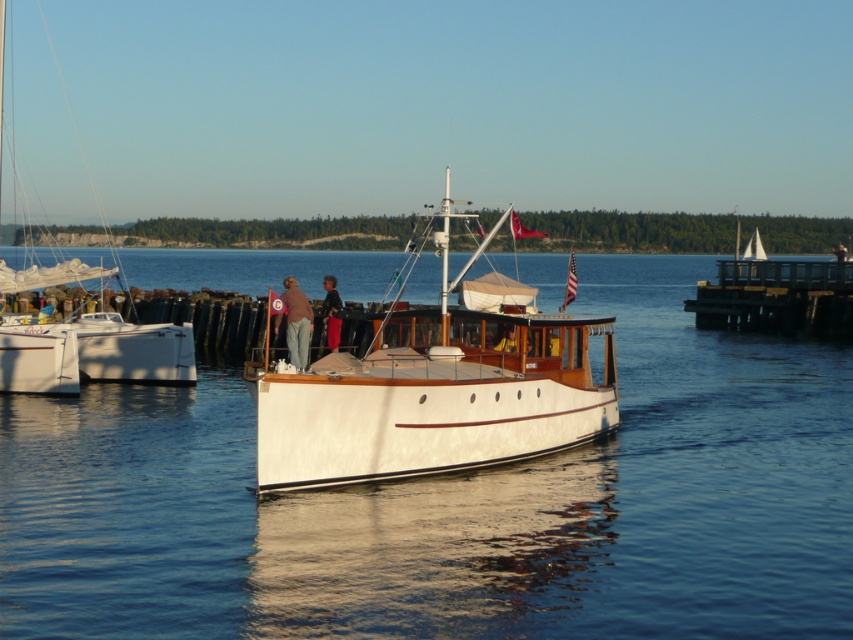
Question: Can you confirm if white polished wood boat at center is positioned below brown wooden dock at right?

Choices:
 (A) no
 (B) yes

Answer: (B)

Question: Which of these objects is positioned closest to the brown wooden dock at right?

Choices:
 (A) light brown pants at center
 (B) white glossy sailboat at left

Answer: (A)

Question: Which of the following is the farthest from the observer?

Choices:
 (A) dark brown leather pants at center
 (B) white polished wood boat at center
 (C) brown wooden dock at right
 (D) light brown pants at center

Answer: (C)

Question: Does white polished wood boat at center appear over light brown pants at center?

Choices:
 (A) no
 (B) yes

Answer: (B)

Question: Among these points, which one is nearest to the camera?

Choices:
 (A) (579, 349)
 (B) (321, 310)

Answer: (B)

Question: Can you confirm if brown wooden dock at right is wider than light brown pants at center?

Choices:
 (A) yes
 (B) no

Answer: (A)